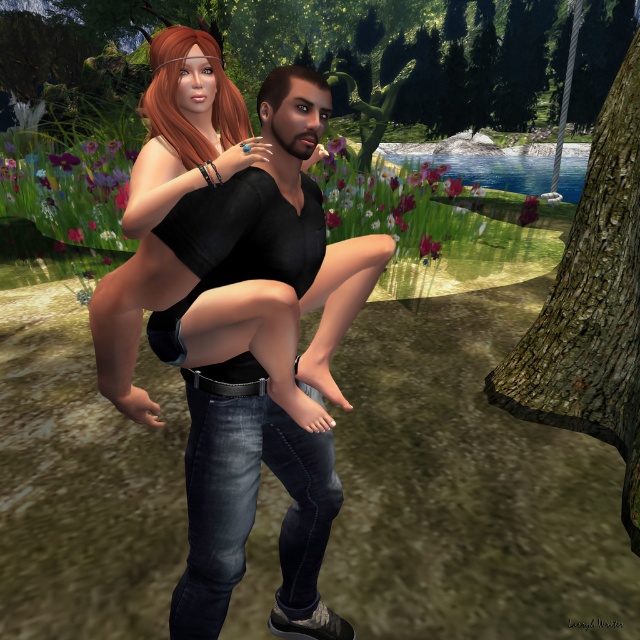
You are standing in the outdoor scene and want to take a photo of the matte black top at center and the brown rough bark tree at right. Which object will appear larger in your photo?

The matte black top at center will appear larger in the photo because it is closer to the viewer than the brown rough bark tree at right.

You are a character in the game and need to reach the brown rough bark tree at right from the matte black top at center. Can you jump and grab the tree within one leap?

The distance between the matte black top at center and the brown rough bark tree at right is 3.31 meters. Assuming an average human jump distance of about 2 meters, you cannot reach the tree in one leap.

You are a painter standing in front of the matte black top at center and the brown rough bark tree at right. You want to paint both objects with a brush that can cover 1 meter width. Which object requires a wider brush?

The matte black top at center might be wider than brown rough bark tree at right, so you should use a wider brush for the matte black top at center.